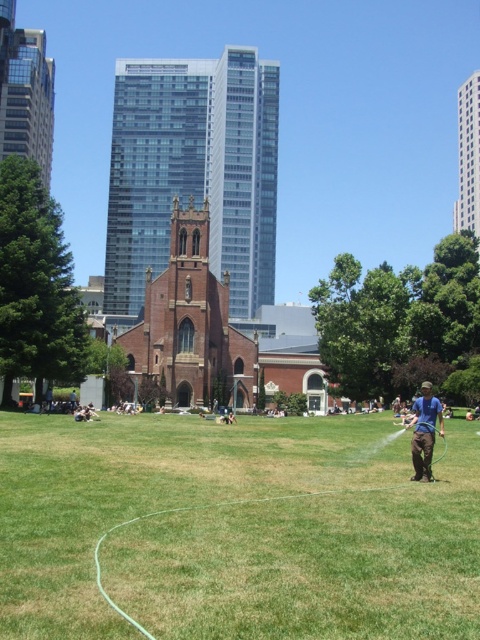
You are a drone operator who needs to fly a drone from the green grass at center to the brown stone church at center. Based on the scene, will the drone have a clear path without obstacles between these two points?

The green grass at center is in front of the brown stone church at center, so the drone would not have a clear path because the church is behind the grass, meaning the grass is closer to the drone operator and the church is further back, possibly blocking the direct path.

You are planning to take a photo of the red brick church at center and the blue fabric at right. Which object should you focus on first if you want to capture both in a single shot without moving the camera?

The red brick church at center is larger in size than the blue fabric at right, so you should focus on the red brick church at center first to ensure it fits properly in the frame before adjusting for the smaller blue fabric at right.

You are a park visitor who wants to cross from the grassy area to the blue fabric at right without stepping on the hose. Based on the scene, which direction should you walk relative to the red brick church at center?

You should walk to the right of the red brick church at center because the blue fabric at right is located to the right of the church, and the hose is curving towards the center, so avoiding the church to the right would keep you away from the hose.